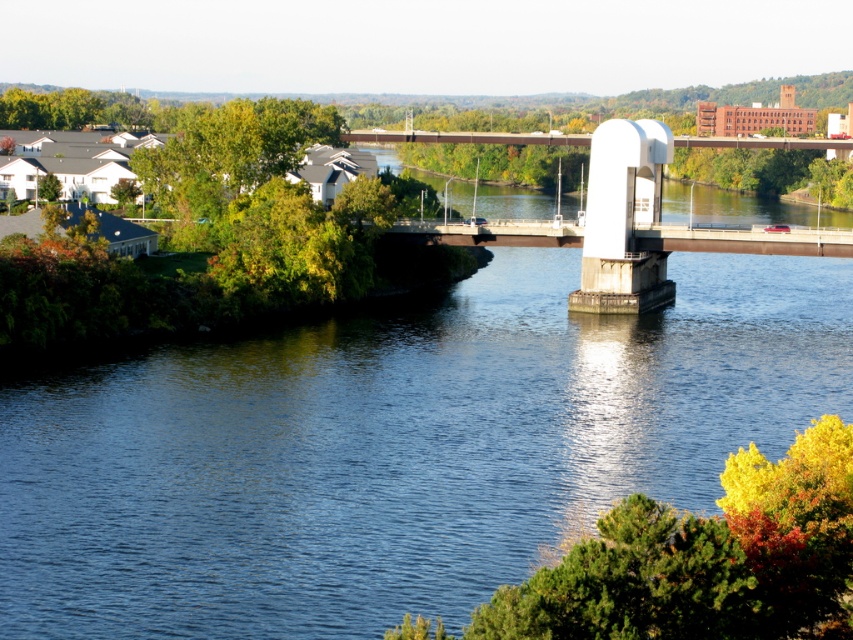
You are a drone operator trying to fly a drone over the blue concrete river at center and the white concrete pedestal at center. Which object should you avoid flying over due to height restrictions?

The blue concrete river at center is not as tall as the white concrete pedestal at center, so you should avoid flying over the white concrete pedestal at center because it is taller and may interfere with the drone.

Based on the photo, you are a delivery truck driver who needs to cross the river using the bridge. The bridge has a maximum load capacity of 10 tons. Your truck weighs 8 tons. There is a blue concrete river at center and a white concrete pedestal at center. Can you safely drive over the bridge? Please explain your reasoning.

The blue concrete river at center has a lesser width compared to white concrete pedestal at center. The maximum load capacity of the bridge is 10 tons, and your truck weighs 8 tons, which is under the limit. Therefore, you can safely drive over the bridge as the weight is within the allowed capacity.